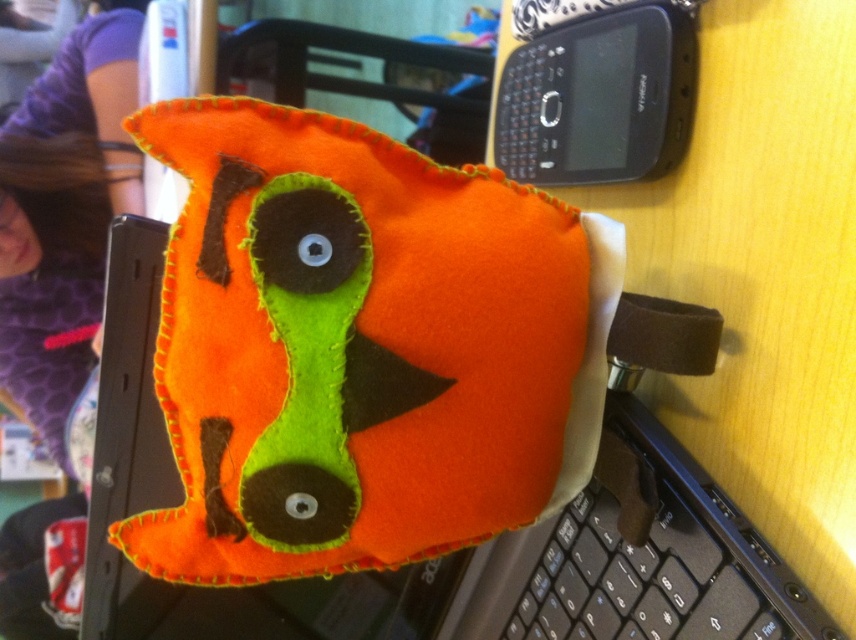
Who is taller, orange felt plush toy at center or black plastic smartphone at upper right?

orange felt plush toy at center is taller.

Can you confirm if orange felt plush toy at center is positioned to the left of black plastic smartphone at upper right?

Indeed, orange felt plush toy at center is positioned on the left side of black plastic smartphone at upper right.

Is point (563, 332) behind point (578, 68)?

No.

Image resolution: width=856 pixels, height=640 pixels. What are the coordinates of `orange felt plush toy at center` in the screenshot? It's located at (352, 348).

Is purple fabric hair at upper left below black plastic keyboard at lower right?

Incorrect, purple fabric hair at upper left is not positioned below black plastic keyboard at lower right.

Is point (84, 22) farther from viewer compared to point (599, 540)?

That is True.

The width and height of the screenshot is (856, 640). What do you see at coordinates (64, 212) in the screenshot?
I see `purple fabric hair at upper left` at bounding box center [64, 212].

Image resolution: width=856 pixels, height=640 pixels. I want to click on purple fabric hair at upper left, so click(x=64, y=212).

Is purple fabric hair at upper left positioned at the back of black plastic smartphone at upper right?

Yes.

Is purple fabric hair at upper left to the right of black plastic smartphone at upper right from the viewer's perspective?

Incorrect, purple fabric hair at upper left is not on the right side of black plastic smartphone at upper right.

The width and height of the screenshot is (856, 640). What do you see at coordinates (64, 212) in the screenshot?
I see `purple fabric hair at upper left` at bounding box center [64, 212].

The image size is (856, 640). In order to click on purple fabric hair at upper left in this screenshot , I will do `click(64, 212)`.